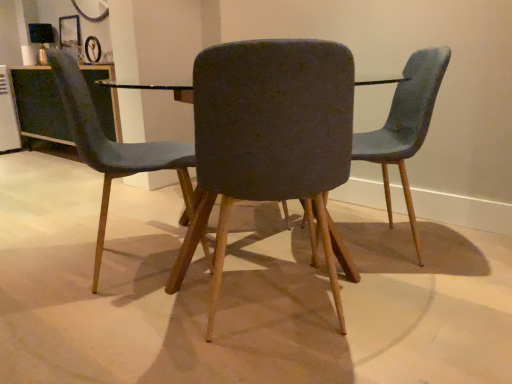
At what (x,y) coordinates should I click in order to perform the action: click on unoccupied region to the right of textured gray chair at center, which is the second chair from right to left. Please return your answer as a coordinate pair (x, y). Looking at the image, I should click on (411, 320).